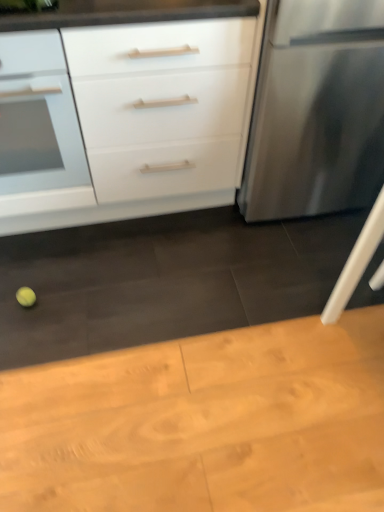
Identify the location of vacant space behind yellow matte tennis ball at lower left. (43, 264).